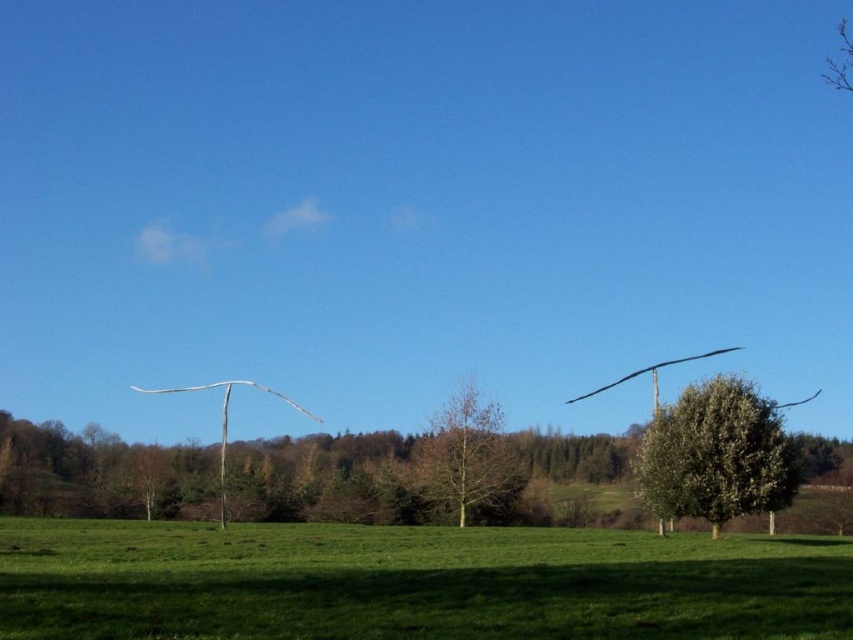
Can you confirm if green grassy field at lower center is thinner than bare wood tree at center?

No, green grassy field at lower center is not thinner than bare wood tree at center.

Does green grassy field at lower center have a smaller size compared to bare wood tree at center?

Incorrect, green grassy field at lower center is not smaller in size than bare wood tree at center.

Describe the element at coordinates (413, 582) in the screenshot. I see `green grassy field at lower center` at that location.

Locate an element on the screen. The height and width of the screenshot is (640, 853). green grassy field at lower center is located at coordinates (413, 582).

Does green grassy field at lower center have a greater height compared to green leafy tree at right?

Yes.

Does green grassy field at lower center come behind green leafy tree at right?

No.

This screenshot has height=640, width=853. Describe the element at coordinates (413, 582) in the screenshot. I see `green grassy field at lower center` at that location.

Find the location of `green grassy field at lower center`. green grassy field at lower center is located at coordinates (413, 582).

Between point (705, 518) and point (463, 442), which one is positioned behind?

The point (463, 442) is behind.

Who is more forward, (695, 493) or (444, 486)?

Point (695, 493) is more forward.

I want to click on green leafy tree at right, so pyautogui.click(x=715, y=454).